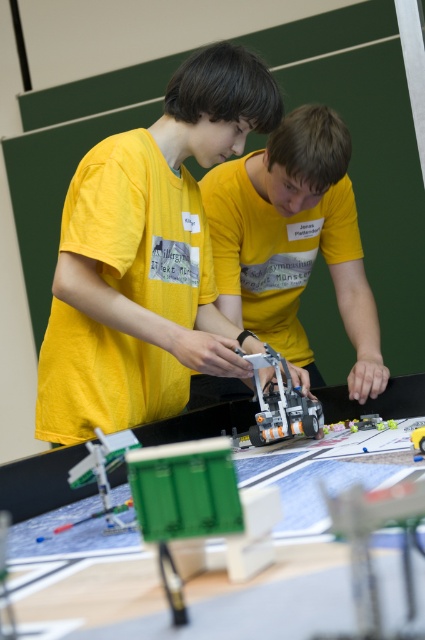
You are standing in the robotics workshop and need to locate the yellow matte shirt at center. According to the coordinates provided, where exactly is it positioned?

The yellow matte shirt at center is located at point 0.378 along the x axis and 0.692 along the y axis.

You are a photographer standing in front of the robotics workshop scene. You need to capture a photo where both the matte yellow shirt at center and the translucent orange plastic robot at center are clearly visible. Based on their sizes, which object should you focus on first to ensure both are in frame?

The matte yellow shirt at center has a greater height compared to the translucent orange plastic robot at center, so you should focus on the matte yellow shirt at center first to ensure both are in frame.

Based on the photo, you are a photographer standing in front of the robotics workshop scene. You need to capture a photo where both the matte yellow shirt at center and the translucent orange plastic robot at center are clearly visible. Based on their sizes, which object should you ensure is closer to the camera to avoid it being too small in the photo?

The translucent orange plastic robot at center should be closer to the camera because it is smaller than the matte yellow shirt at center, ensuring it appears large enough in the photo.